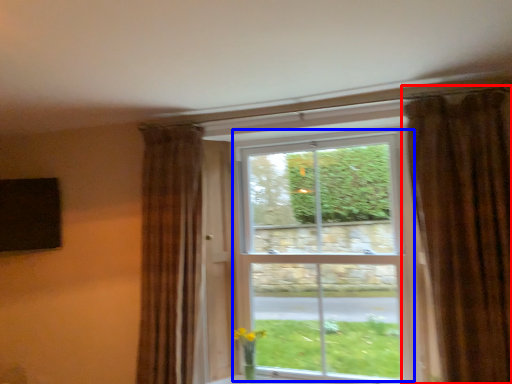
Question: Which object is closer to the camera taking this photo, curtain (highlighted by a red box) or bay window (highlighted by a blue box)?

Choices:
 (A) curtain
 (B) bay window

Answer: (A)